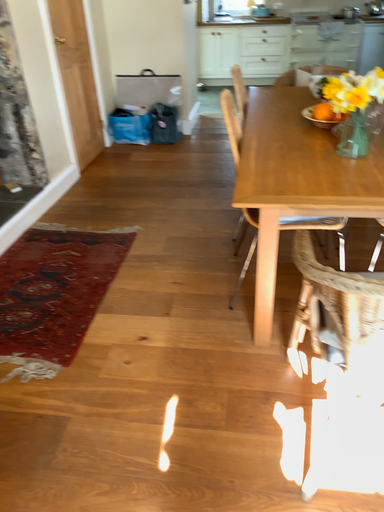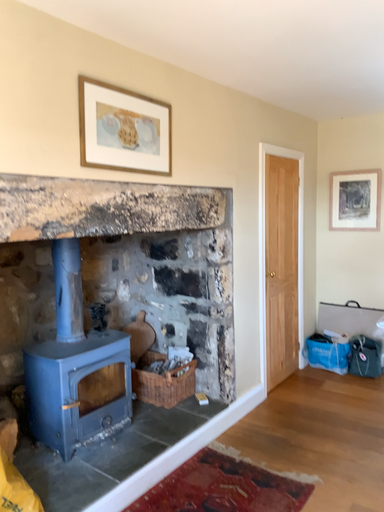
Question: How did the camera likely rotate when shooting the video?

Choices:
 (A) rotated upward
 (B) rotated downward

Answer: (A)